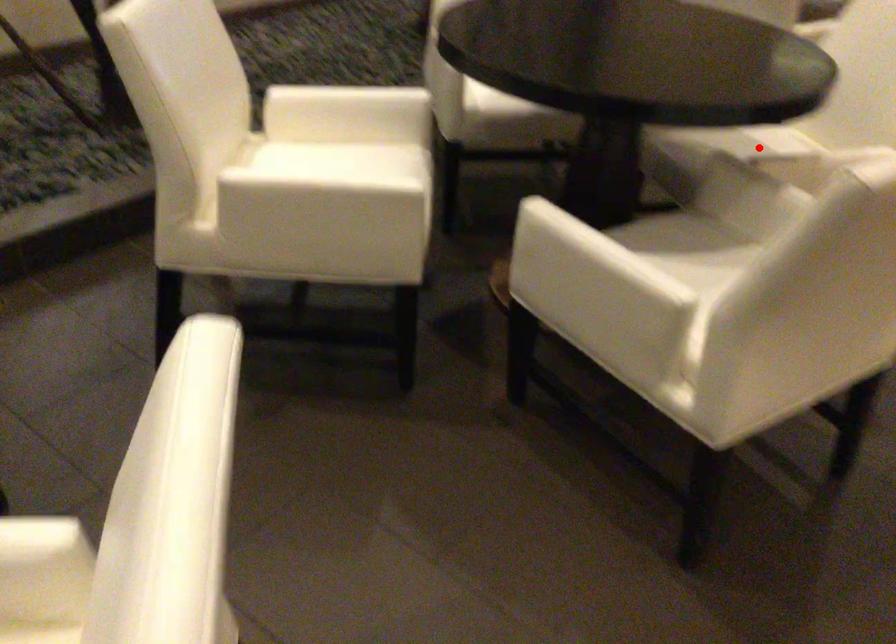
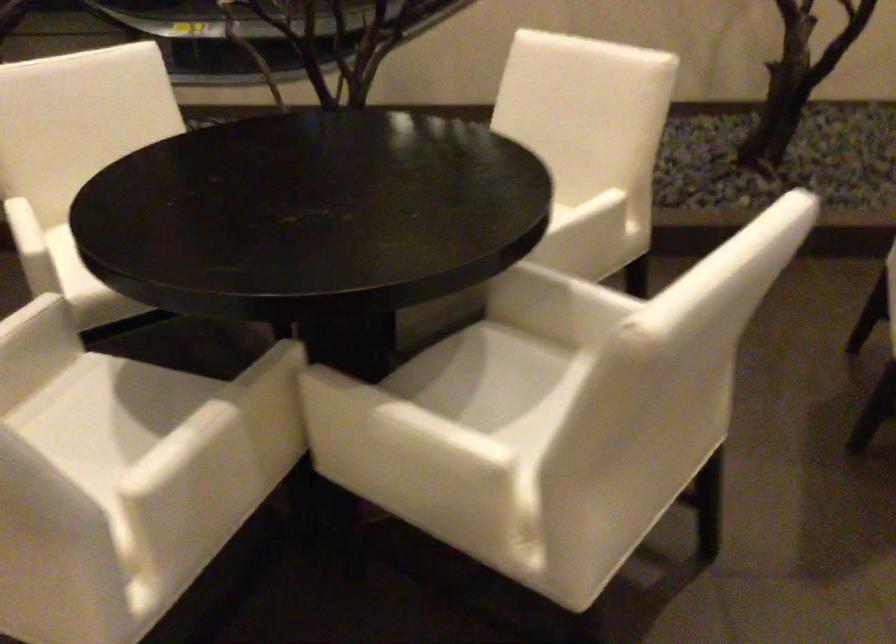
Locate, in the second image, the point that corresponds to the highlighted location in the first image.

(504, 393)